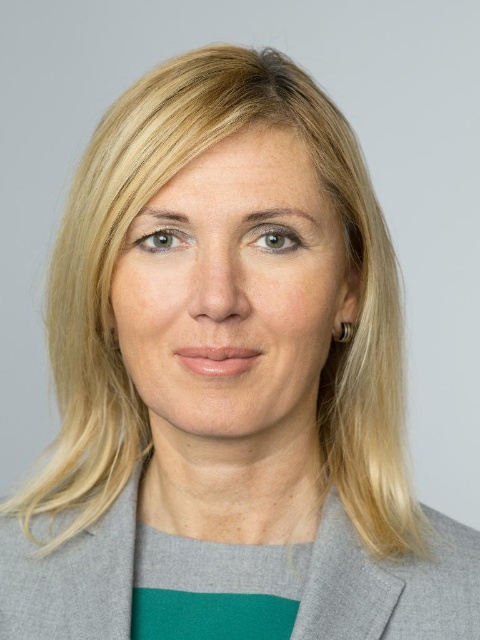
You are a photographer adjusting the lighting for a professional headshot. You need to ensure that the smooth skin face at center is properly lit compared to the gray woolen blazer at center. According to the scene description, where should you focus your lighting adjustments?

The smooth skin face at center is located above the gray woolen blazer at center. Since the face is above the blazer, you should focus the lighting adjustments on the upper part of the subject to ensure the face is properly lit compared to the blazer.

You are holding a 12 inch ruler and want to measure the distance between your eye and the point at coordinates point [288,275] in the image. Can you determine if the distance is within the ruler length?

The distance between you and the point at point [288,275] is 16.38 inches, which is longer than the 12 inch ruler. Therefore, the ruler is not long enough to measure the distance.